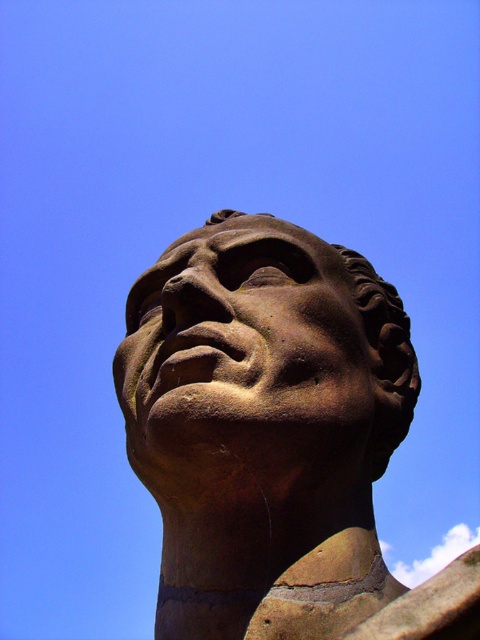
Question: Which of the following is the farthest from the observer?

Choices:
 (A) brown stone face at center
 (B) brown stone head at center

Answer: (A)

Question: Is brown stone head at center positioned at the back of brown stone face at center?

Choices:
 (A) yes
 (B) no

Answer: (B)

Question: Is brown stone head at center to the right of brown stone face at center from the viewer's perspective?

Choices:
 (A) no
 (B) yes

Answer: (B)

Question: Is brown stone head at center positioned behind brown stone face at center?

Choices:
 (A) yes
 (B) no

Answer: (B)